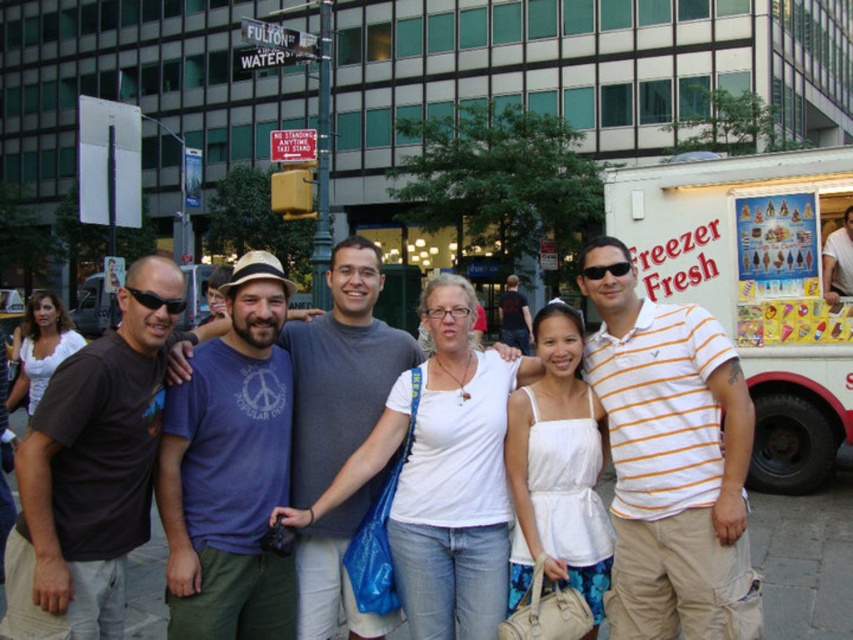
You are standing in the city street scene and want to reach the point at coordinates point (770,157). If you can walk 1.5 meters per second, how long will it take you to reach there?

The point (770,157) is 7.28 meters from viewer. At a walking speed of 1.5 meters per second, it would take approximately 4.85 seconds to reach there.

You are a photographer trying to capture a clear shot of the matte white shirt at center and the white cardboard freezer fresh at right. Since both are white, you need to adjust your camera settings to distinguish them. Which object should you focus on first to ensure proper exposure, considering their positions?

The white cardboard freezer fresh at right is above the matte white shirt at center. Since it is higher up, focusing on it first might help balance the exposure for both objects.